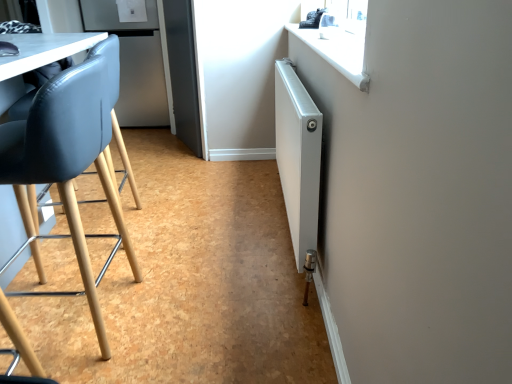
Where is `free space behind matte black chair at left`? free space behind matte black chair at left is located at coordinates (121, 256).